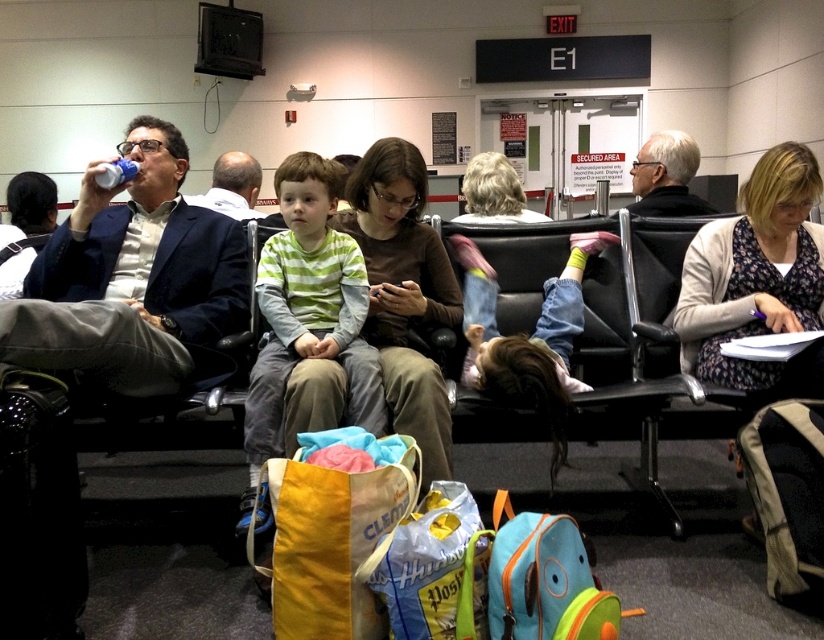
Question: Which is farther from the green striped shirt at center?

Choices:
 (A) denim jeans at center
 (B) black leather chair at center
 (C) dark blue fabric chair at left

Answer: (B)

Question: Can you confirm if black leather chair at center is thinner than green striped shirt at center?

Choices:
 (A) yes
 (B) no

Answer: (B)

Question: Is the position of black leather chair at center less distant than that of green striped shirt at center?

Choices:
 (A) yes
 (B) no

Answer: (B)

Question: Which object appears farthest from the camera in this image?

Choices:
 (A) green striped shirt at center
 (B) black leather chair at center
 (C) denim jeans at center
 (D) dark blue fabric chair at left

Answer: (B)

Question: Which of the following is the closest to the observer?

Choices:
 (A) dark blue fabric chair at left
 (B) denim jeans at center
 (C) black leather chair at center

Answer: (A)

Question: Observing the image, what is the correct spatial positioning of dark blue fabric chair at left in reference to denim jeans at center?

Choices:
 (A) above
 (B) below

Answer: (B)